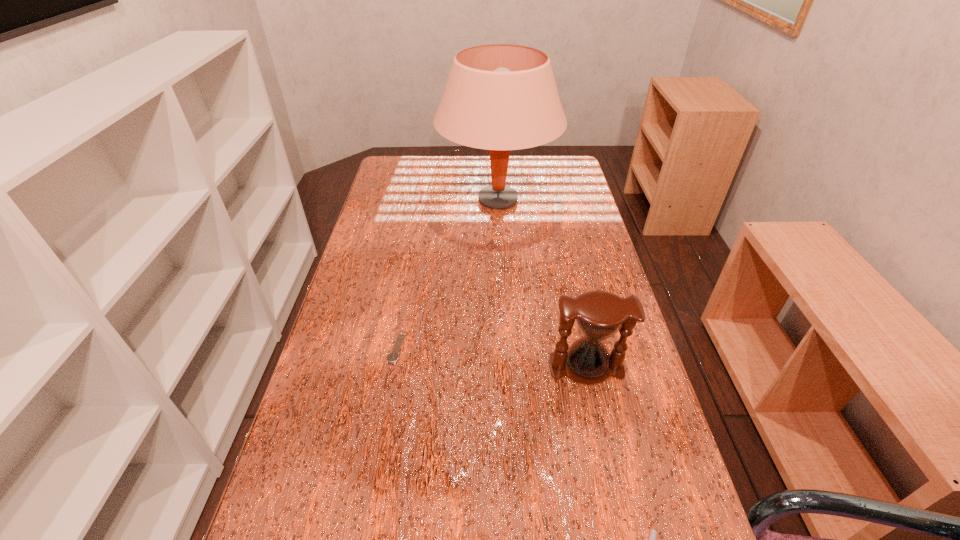
I want to click on lampshade, so click(x=500, y=97).

Locate an element on the screen. the farthest object is located at coordinates (500, 97).

You are a GUI agent. You are given a task and a screenshot of the screen. Output one action in this format:
    pyautogui.click(x=<x>, y=<y>)
    Task: Click on the hourglass
    
    Given the screenshot: What is the action you would take?
    pyautogui.click(x=600, y=315)

Locate an element on the screen. The width and height of the screenshot is (960, 540). the left watch is located at coordinates (393, 356).

The image size is (960, 540). Identify the location of the leftmost object. (393, 356).

Identify the location of vacant position located on the front-facing side of the farthest object. (389, 200).

Identify the location of free space located 0.120m on the front-facing side of the farthest object. (405, 200).

Locate an element on the screen. The width and height of the screenshot is (960, 540). vacant region located on the front-facing side of the farthest object is located at coordinates (397, 200).

Identify the location of vacant space located 0.280m on the left of the hourglass. (430, 368).

At what (x,y) coordinates should I click in order to perform the action: click on free space located 0.210m on the front of the left watch. Please return your answer as a coordinate pair (x, y). The width and height of the screenshot is (960, 540). Looking at the image, I should click on (378, 451).